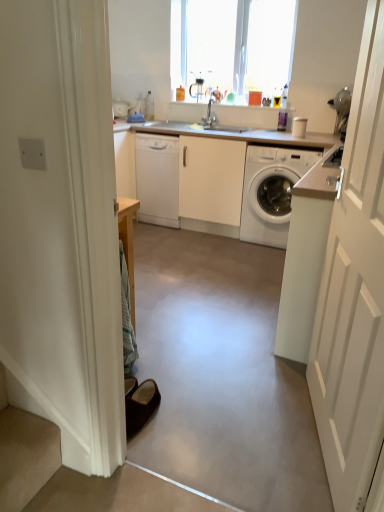
Image resolution: width=384 pixels, height=512 pixels. I want to click on free space to the back side of brown suede slippers at lower left, so click(x=167, y=381).